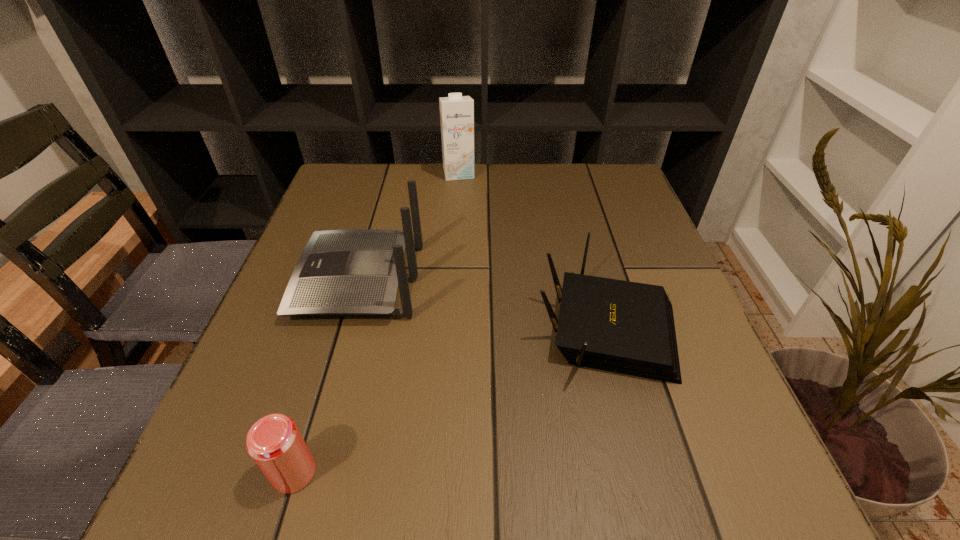
Where is `vacant space that satisfies the following two spatial constraints: 1. on the front-facing side of the left router; 2. on the left side of the rightmost object`? This screenshot has height=540, width=960. vacant space that satisfies the following two spatial constraints: 1. on the front-facing side of the left router; 2. on the left side of the rightmost object is located at coordinates (347, 323).

At what (x,y) coordinates should I click in order to perform the action: click on free spot that satisfies the following two spatial constraints: 1. on the back side of the right router; 2. on the front-facing side of the third shortest object. Please return your answer as a coordinate pair (x, y). Looking at the image, I should click on (594, 280).

The height and width of the screenshot is (540, 960). In order to click on vacant space that satisfies the following two spatial constraints: 1. on the back side of the beer can; 2. on the right side of the farthest object in this screenshot , I will do `click(386, 173)`.